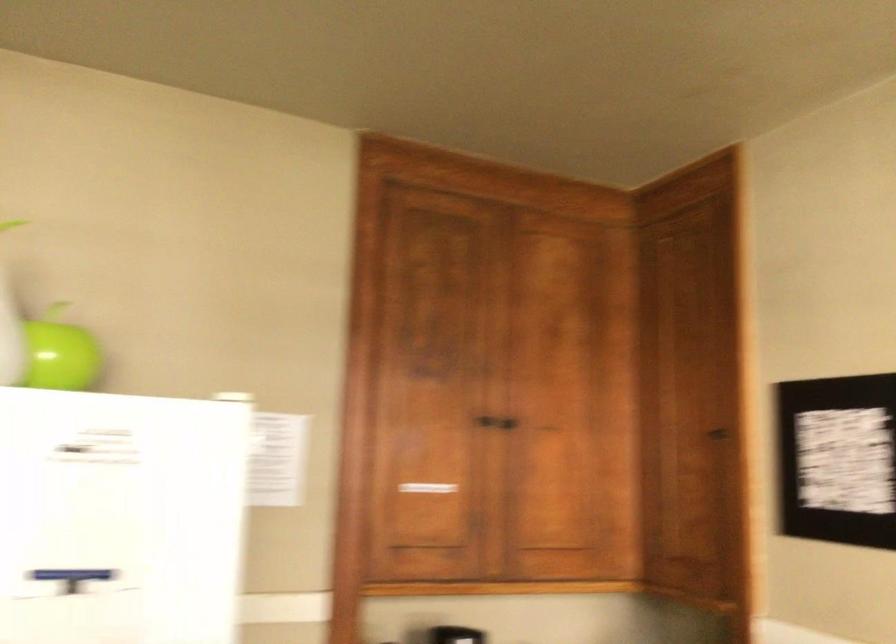
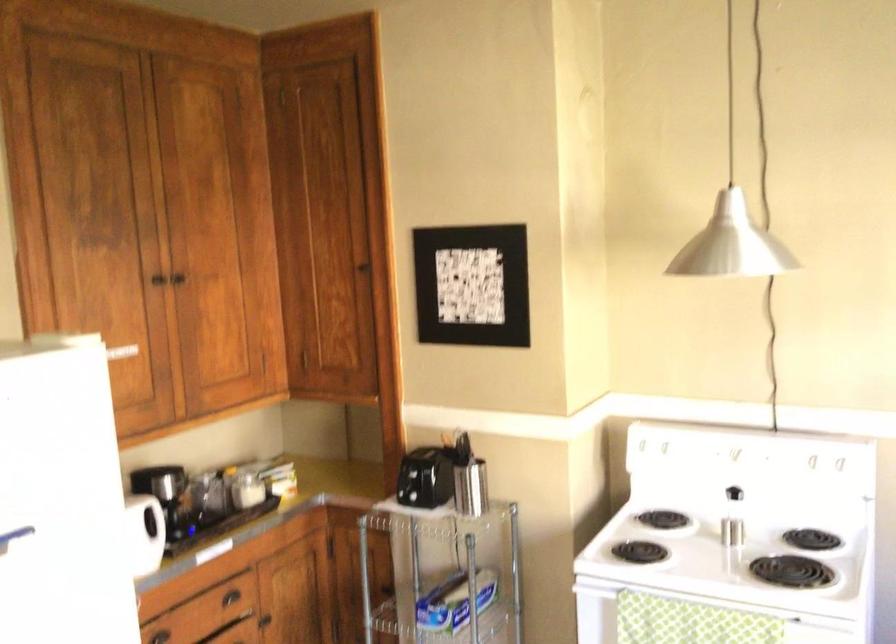
Based on the continuous images, in which direction is the camera rotating?

The camera's rotation is toward right-down.